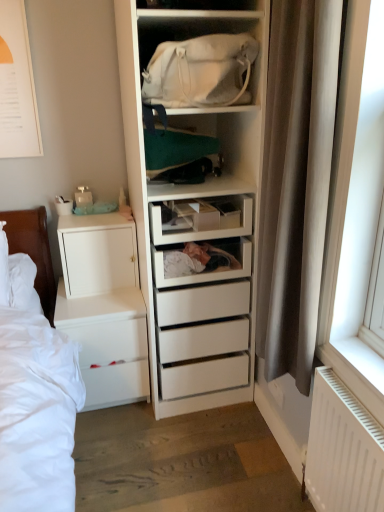
The width and height of the screenshot is (384, 512). Find the location of `vacant space in front of white matte chest of drawers at lower left`. vacant space in front of white matte chest of drawers at lower left is located at coordinates pyautogui.click(x=118, y=441).